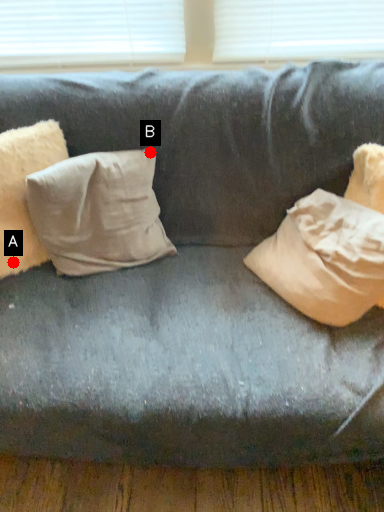
Question: Two points are circled on the image, labeled by A and B beside each circle. Which point appears farthest from the camera in this image?

Choices:
 (A) A is further
 (B) B is further

Answer: (B)